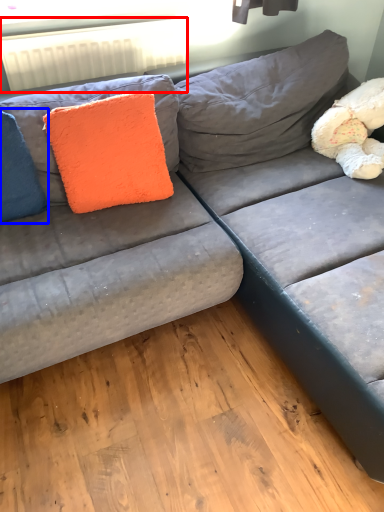
Question: Which object is closer to the camera taking this photo, radiator (highlighted by a red box) or pillow (highlighted by a blue box)?

Choices:
 (A) radiator
 (B) pillow

Answer: (B)